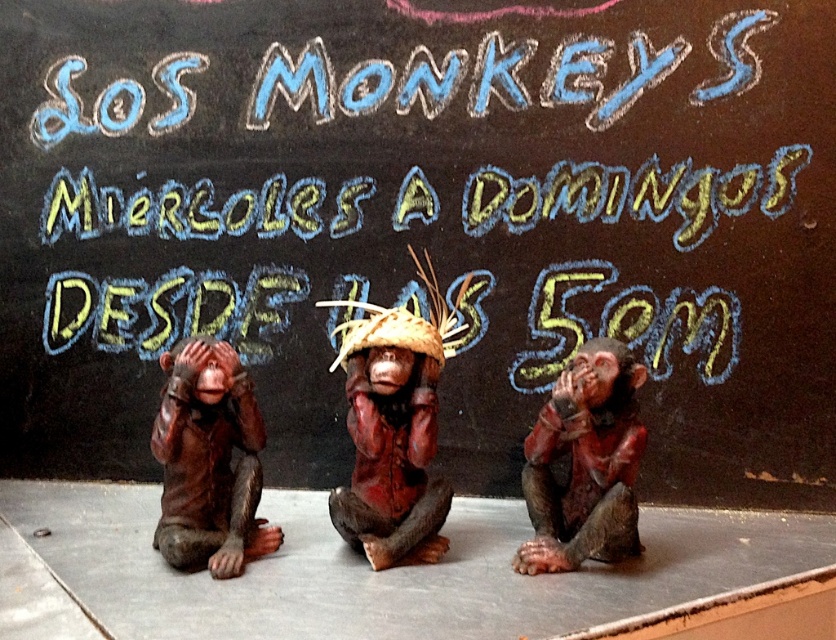
Consider the image. Is matte brown statue at left thinner than matte brown monkey at center?

No, matte brown statue at left is not thinner than matte brown monkey at center.

Measure the distance between matte brown statue at left and camera.

1.72 meters

Locate an element on the screen. This screenshot has width=836, height=640. matte brown statue at left is located at coordinates (209, 461).

Is the position of matte brown statue at center less distant than that of matte brown statue at left?

No, matte brown statue at center is behind matte brown statue at left.

Is point (451, 330) closer to viewer compared to point (194, 432)?

That is False.

Identify the location of matte brown statue at center. (394, 428).

Between matte brown statue at center and matte brown monkey at center, which one is positioned lower?

matte brown monkey at center is lower down.

Which of these two, matte brown statue at center or matte brown monkey at center, stands taller?

With more height is matte brown statue at center.

Is point (349, 497) positioned before point (635, 371)?

No.

You are a GUI agent. You are given a task and a screenshot of the screen. Output one action in this format:
    pyautogui.click(x=<x>, y=<y>)
    Task: Click on the matte brown statue at center
    This screenshot has height=640, width=836.
    Given the screenshot: What is the action you would take?
    pyautogui.click(x=394, y=428)